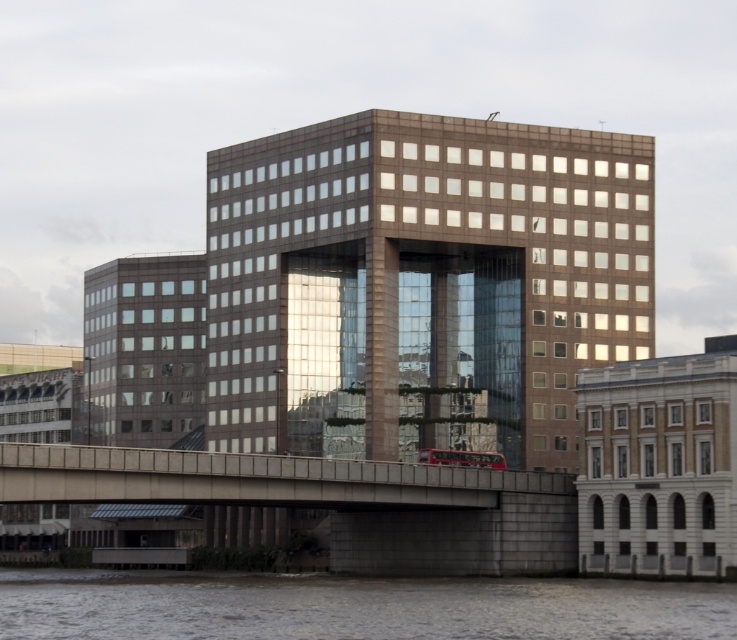
Is brown water at lower center smaller than concrete bridge at center?

Incorrect, brown water at lower center is not smaller in size than concrete bridge at center.

Can you confirm if brown water at lower center is bigger than concrete bridge at center?

Yes.

Is point (21, 618) more distant than point (57, 458)?

No, (21, 618) is in front of (57, 458).

The height and width of the screenshot is (640, 737). In order to click on brown water at lower center in this screenshot , I will do `click(352, 605)`.

Is point (394, 232) positioned behind point (429, 525)?

Yes.

Consider the image. Is brown glass building at center positioned before concrete bridge at center?

No, it is not.

Is point (581, 296) farther from camera compared to point (426, 531)?

That is True.

The width and height of the screenshot is (737, 640). I want to click on brown glass building at center, so click(422, 284).

Between brown glass building at center and brown water at lower center, which one has more height?

brown glass building at center

Does point (296, 385) lie in front of point (189, 589)?

No, it is not.

Where is `brown glass building at center`? This screenshot has width=737, height=640. brown glass building at center is located at coordinates (422, 284).